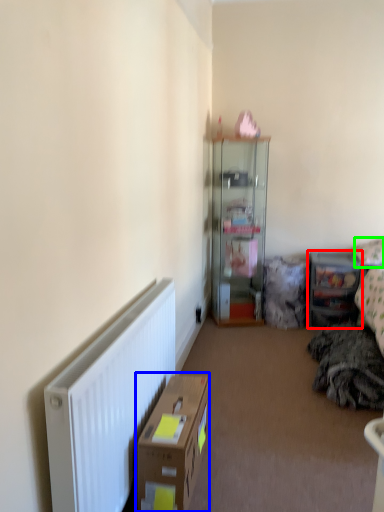
Question: Which is nearer to the shelf (highlighted by a red box)? cardboard box (highlighted by a blue box) or pillow (highlighted by a green box).

Choices:
 (A) cardboard box
 (B) pillow

Answer: (B)